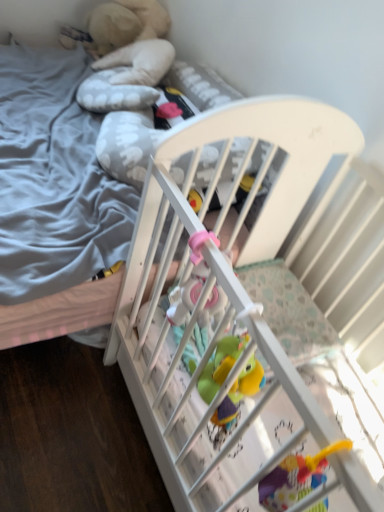
Question: Should I look upward or downward to see pink rubber toy at center?

Choices:
 (A) up
 (B) down

Answer: (B)

Question: From a real-world perspective, does white wooden crib at center sit lower than pink rubber toy at center?

Choices:
 (A) yes
 (B) no

Answer: (A)

Question: Is white wooden crib at center looking in the opposite direction of pink rubber toy at center?

Choices:
 (A) no
 (B) yes

Answer: (A)

Question: Does white wooden crib at center have a greater width compared to pink rubber toy at center?

Choices:
 (A) no
 (B) yes

Answer: (B)

Question: Can you see white wooden crib at center touching pink rubber toy at center?

Choices:
 (A) no
 (B) yes

Answer: (A)

Question: Can you confirm if white wooden crib at center is taller than pink rubber toy at center?

Choices:
 (A) no
 (B) yes

Answer: (A)

Question: Is pink rubber toy at center inside white wooden crib at center?

Choices:
 (A) yes
 (B) no

Answer: (B)

Question: Is pink rubber toy at center taller than white wooden crib at center?

Choices:
 (A) no
 (B) yes

Answer: (B)

Question: Is white wooden crib at center inside pink rubber toy at center?

Choices:
 (A) no
 (B) yes

Answer: (A)

Question: From the image's perspective, is pink rubber toy at center under white wooden crib at center?

Choices:
 (A) yes
 (B) no

Answer: (B)

Question: Can you confirm if pink rubber toy at center is thinner than white wooden crib at center?

Choices:
 (A) no
 (B) yes

Answer: (B)

Question: From a real-world perspective, is pink rubber toy at center on top of white wooden crib at center?

Choices:
 (A) no
 (B) yes

Answer: (B)

Question: Considering the relative sizes of pink rubber toy at center and white wooden crib at center in the image provided, is pink rubber toy at center smaller than white wooden crib at center?

Choices:
 (A) yes
 (B) no

Answer: (A)

Question: From a real-world perspective, is pink rubber toy at center above or below white wooden crib at center?

Choices:
 (A) above
 (B) below

Answer: (A)